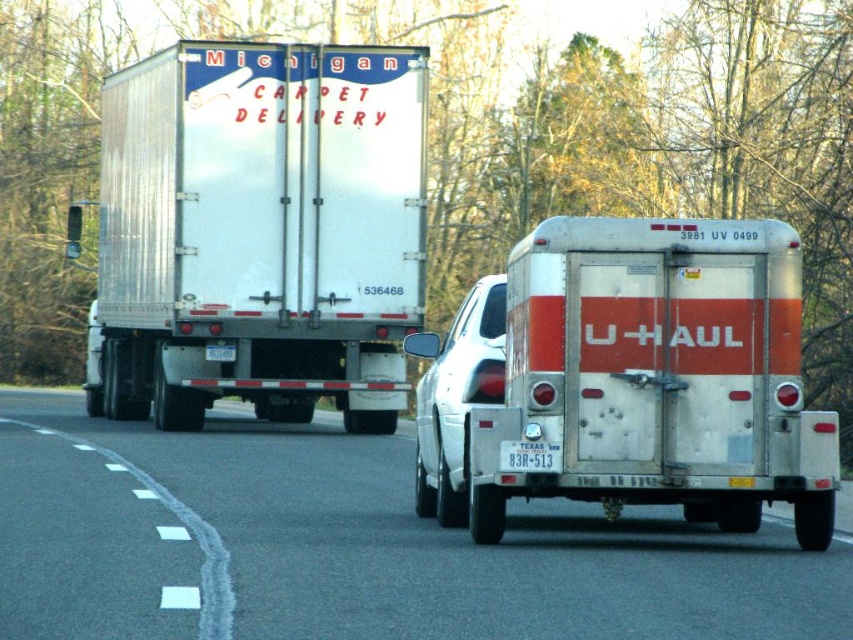
Is point (196, 368) more distant than point (520, 448)?

That is True.

Can you confirm if silver metallic trailer truck at center is positioned below white plastic license plate at center?

Actually, silver metallic trailer truck at center is above white plastic license plate at center.

Does point (350, 49) come farther from viewer compared to point (541, 460)?

Yes, point (350, 49) is farther from viewer.

At what (x,y) coordinates should I click in order to perform the action: click on silver metallic trailer truck at center. Please return your answer as a coordinate pair (x, y). This screenshot has height=640, width=853. Looking at the image, I should click on (260, 230).

Between point (653, 618) and point (450, 520), which one is positioned in front?

Point (653, 618) is in front.

Describe the element at coordinates (352, 547) in the screenshot. This screenshot has width=853, height=640. I see `metallic silver trailer at center` at that location.

Locate an element on the screen. The image size is (853, 640). metallic silver trailer at center is located at coordinates (352, 547).

Is white plastic license plate at center to the left of white plastic license plate at rear from the viewer's perspective?

In fact, white plastic license plate at center is to the right of white plastic license plate at rear.

Between point (502, 460) and point (230, 348), which one is positioned behind?

The point (230, 348) is behind.

The height and width of the screenshot is (640, 853). What do you see at coordinates (529, 456) in the screenshot?
I see `white plastic license plate at center` at bounding box center [529, 456].

You are a GUI agent. You are given a task and a screenshot of the screen. Output one action in this format:
    pyautogui.click(x=<x>, y=<y>)
    Task: Click on the white plastic license plate at center
    This screenshot has height=640, width=853.
    Given the screenshot: What is the action you would take?
    click(529, 456)